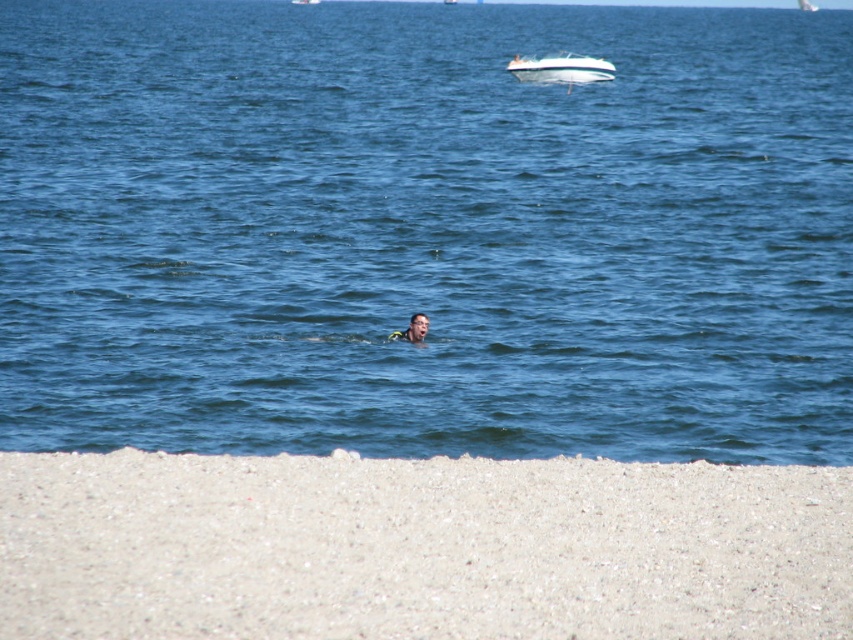
You are a photographer planning to capture a wide shot of the beach scene. You need to ensure both the white glossy boat at upper center and the smooth skin face at center are fully visible in the frame. Based on their sizes, which object will require more horizontal space in the photo?

The white glossy boat at upper center requires more horizontal space in the photo because its width surpasses that of the smooth skin face at center.

You are standing on the sandy beach in the image and see the point at coordinates (x=561, y=68). Which object in the scene is located at that point?

The point at coordinates (x=561, y=68) is located on the white glossy boat at upper center.